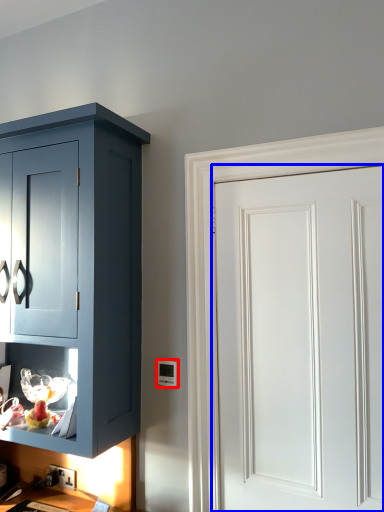
Question: Which point is closer to the camera, light switch (highlighted by a red box) or door (highlighted by a blue box)?

Choices:
 (A) light switch
 (B) door

Answer: (B)